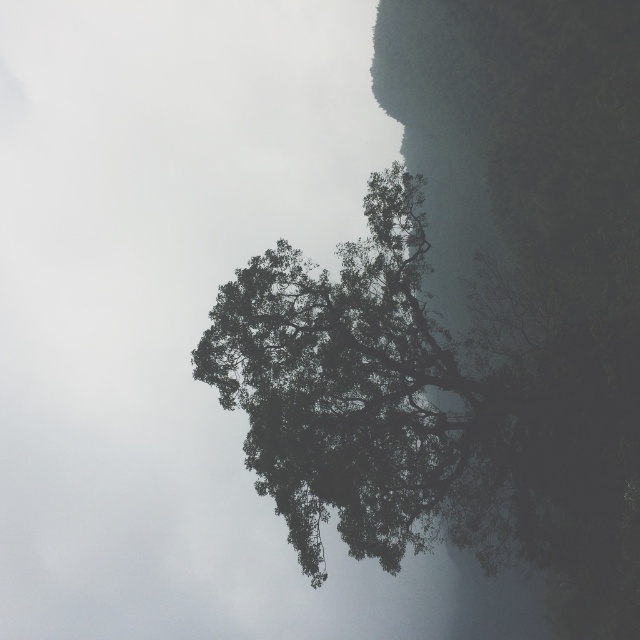
Question: Which object appears farthest from the camera in this image?

Choices:
 (A) transparent fog at center
 (B) dark green leafy tree at center

Answer: (A)

Question: Is dark green textured cliff at center thinner than dark green leafy tree at center?

Choices:
 (A) no
 (B) yes

Answer: (B)

Question: Among these points, which one is nearest to the camera?

Choices:
 (A) (326, 413)
 (B) (252, 568)

Answer: (A)

Question: Which point is closer to the camera?

Choices:
 (A) transparent fog at center
 (B) dark green leafy tree at center
 (C) dark green textured cliff at center

Answer: (B)

Question: Is transparent fog at center below dark green textured cliff at center?

Choices:
 (A) yes
 (B) no

Answer: (B)

Question: Can you confirm if dark green textured cliff at center is positioned above dark green leafy tree at center?

Choices:
 (A) yes
 (B) no

Answer: (A)